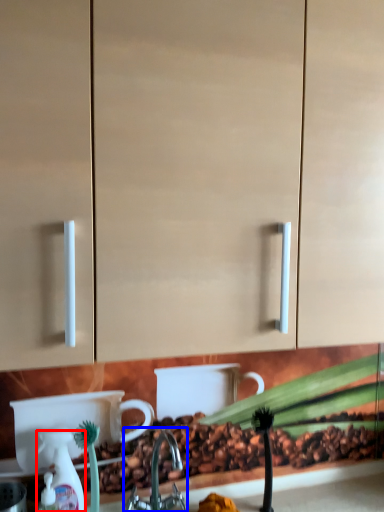
Question: Which point is closer to the camera, soap dispenser (highlighted by a red box) or tap (highlighted by a blue box)?

Choices:
 (A) soap dispenser
 (B) tap

Answer: (B)